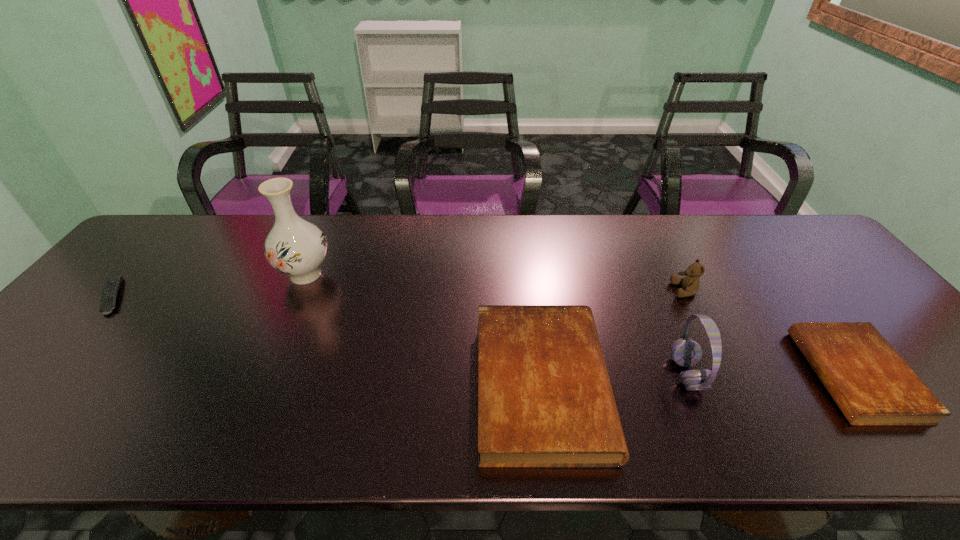
This screenshot has height=540, width=960. I want to click on free location located 0.240m on the front-facing side of the fourth shortest object, so click(x=586, y=290).

Where is `vacant space located on the headband and ear cups of the headset`? vacant space located on the headband and ear cups of the headset is located at coordinates (550, 374).

Find the location of a particular element. vacant region located 0.320m on the headband and ear cups of the headset is located at coordinates (533, 374).

I want to click on free space located 0.150m on the headband and ear cups of the headset, so click(x=607, y=374).

Where is `object that is at the far edge`? The image size is (960, 540). object that is at the far edge is located at coordinates (295, 247).

Identify the location of headset that is at the near edge. (685, 352).

I want to click on object at the left edge, so click(x=112, y=285).

Find the location of `object that is at the right edge`. object that is at the right edge is located at coordinates (872, 385).

I want to click on object present at the near right corner, so click(872, 385).

The height and width of the screenshot is (540, 960). What are the coordinates of `vacant space at the far edge of the desktop` in the screenshot? It's located at (540, 215).